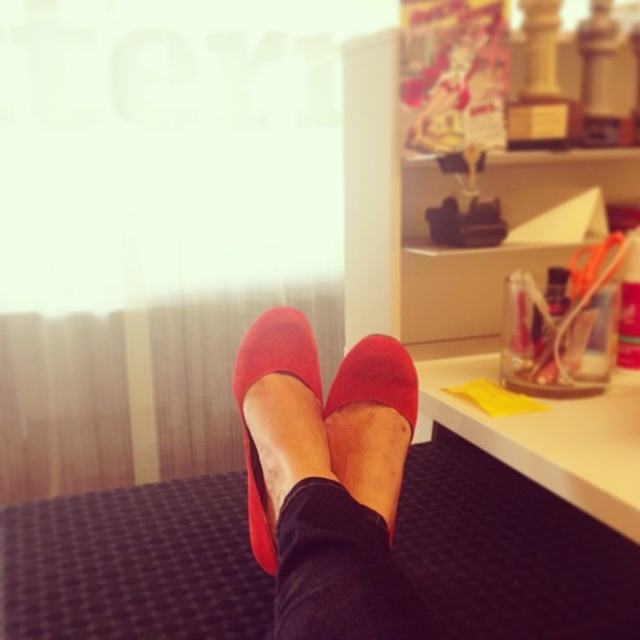
What are the coordinates of `suede red shoes at center` in the screenshot? It's located at (330, 483).

Find the location of `suede red shoes at center`. suede red shoes at center is located at coordinates (330, 483).

Between black suede ankle at center and suede-like red shoe at center, which one has more height?

suede-like red shoe at center

Between black suede ankle at center and suede-like red shoe at center, which one has less height?

With less height is black suede ankle at center.

Is point (320, 493) positioned behind point (289, 358)?

No, (320, 493) is in front of (289, 358).

In order to click on black suede ankle at center in this screenshot , I will do `click(328, 531)`.

Which is more to the left, suede red shoes at center or suede-like red slipper at center?

suede red shoes at center

Between suede red shoes at center and suede-like red slipper at center, which one is positioned lower?

suede red shoes at center

Find the location of a particular element. This screenshot has width=640, height=640. suede red shoes at center is located at coordinates (330, 483).